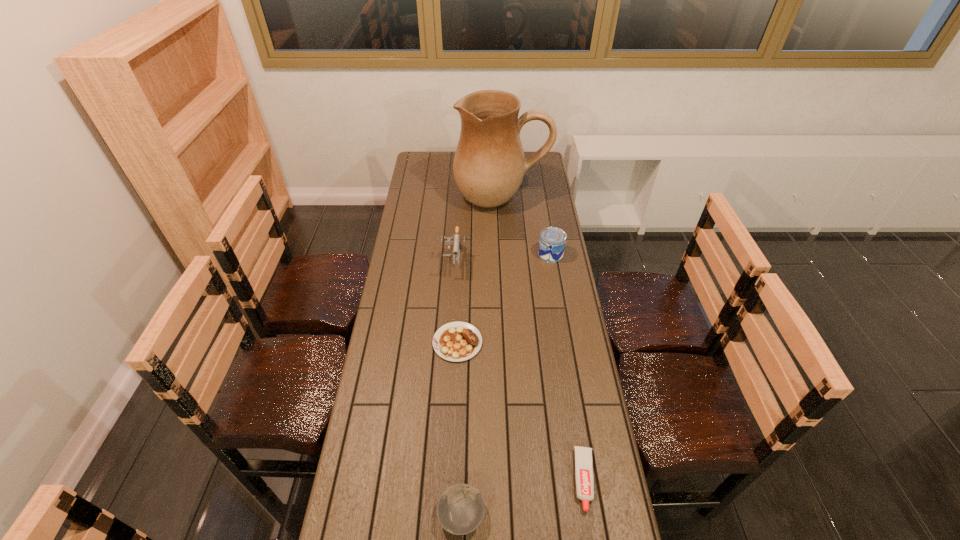
The width and height of the screenshot is (960, 540). I want to click on the farthest object, so click(489, 164).

Where is `cream pitcher`? This screenshot has width=960, height=540. cream pitcher is located at coordinates (489, 164).

What are the coordinates of `gun` in the screenshot? It's located at (457, 238).

Find the location of `the fourth shortest object`. the fourth shortest object is located at coordinates (552, 242).

This screenshot has width=960, height=540. Identify the location of toothpaste. (583, 455).

This screenshot has height=540, width=960. What are the coordinates of `the third nearest object` in the screenshot? It's located at (458, 341).

Where is `free space located at the spout of the farthest object`? free space located at the spout of the farthest object is located at coordinates (503, 228).

You are a GUI agent. You are given a task and a screenshot of the screen. Output one action in this format:
    pyautogui.click(x=<x>, y=<y>)
    Task: Click on the vacant region located 0.140m at the barrel end of the second tallest object
    The image size is (960, 540).
    Given the screenshot: What is the action you would take?
    pyautogui.click(x=451, y=305)

Image resolution: width=960 pixels, height=540 pixels. In order to click on free space located 0.330m on the front label of the can in this screenshot , I will do `click(462, 254)`.

I want to click on vacant space positioned 0.060m on the front label of the can, so click(524, 254).